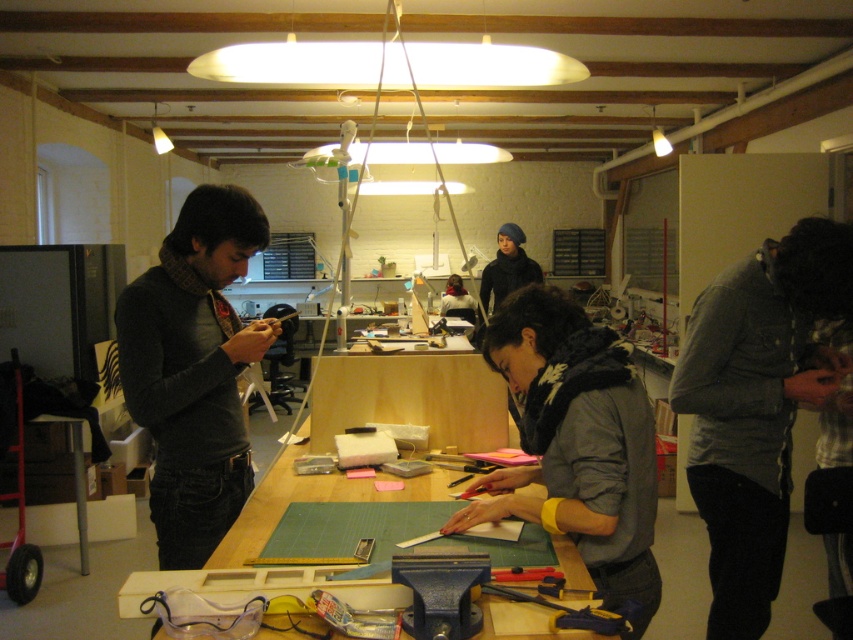
Question: Considering the relative positions of green matte table at center and metallic silver screwdriver at lower center in the image provided, where is green matte table at center located with respect to metallic silver screwdriver at lower center?

Choices:
 (A) below
 (B) above

Answer: (B)

Question: Based on their relative distances, which object is farther from the blue metal vise at lower center?

Choices:
 (A) metallic silver screwdriver at lower center
 (B) green matte table at center
 (C) dark gray sweater at left

Answer: (B)

Question: Does gray fabric scarf at center have a lesser width compared to green cutting mat at center?

Choices:
 (A) no
 (B) yes

Answer: (B)

Question: Which object appears farthest from the camera in this image?

Choices:
 (A) gray fabric scarf at center
 (B) dark gray sweater at left
 (C) green matte table at center

Answer: (C)

Question: Which object appears farthest from the camera in this image?

Choices:
 (A) gray textured jacket at lower right
 (B) blue metal vise at lower center

Answer: (A)

Question: Is dark gray sweater at left thinner than gray fabric scarf at center?

Choices:
 (A) yes
 (B) no

Answer: (A)